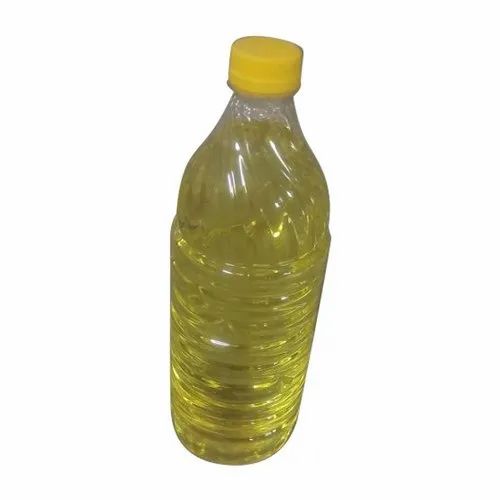
Locate an element on the screen. bottle is located at coordinates (x=244, y=278), (x=257, y=141), (x=266, y=67), (x=244, y=404).